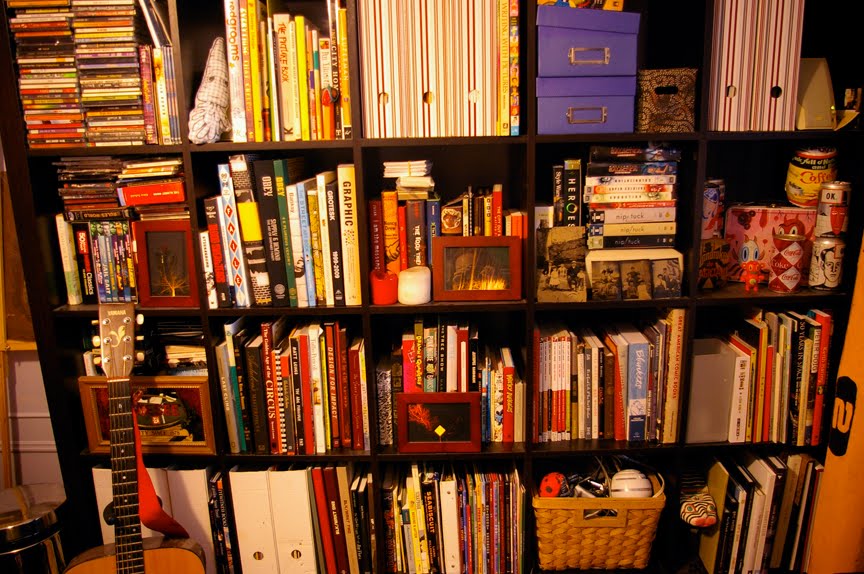
This screenshot has height=574, width=864. Find the location of `blue and white book spine`. blue and white book spine is located at coordinates (638, 366).